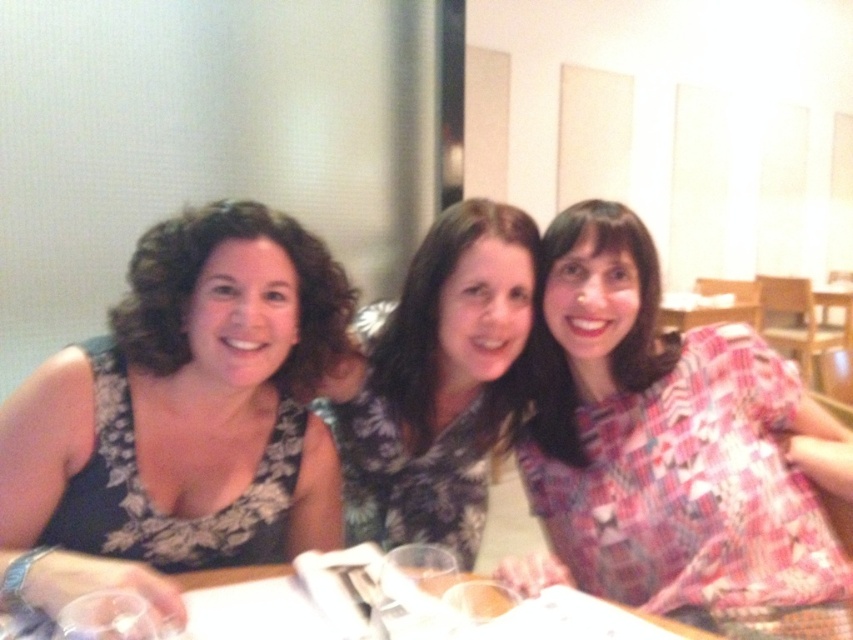
Who is higher up, floral fabric dress at center or wooden table at center?

floral fabric dress at center

Which is behind, point (398, 529) or point (283, 598)?

Point (398, 529)

Is point (503, 257) positioned behind point (210, 579)?

Yes.

Where is `floral fabric dress at center`? floral fabric dress at center is located at coordinates (434, 381).

Does floral fabric dress at left have a greater height compared to wooden table at center?

Indeed, floral fabric dress at left has a greater height compared to wooden table at center.

Between point (322, 509) and point (276, 609), which one is positioned in front?

Point (276, 609) is more forward.

Does point (234, 227) come in front of point (312, 621)?

No, it is behind (312, 621).

This screenshot has width=853, height=640. Identify the location of floral fabric dress at left. (189, 404).

Which is in front, point (331, 392) or point (438, 548)?

Point (438, 548)

Is floral fabric dress at center smaller than clear glass wine glass at center?

No, floral fabric dress at center is not smaller than clear glass wine glass at center.

Does point (390, 314) lie in front of point (422, 556)?

That is False.

Where is `floral fabric dress at center`? floral fabric dress at center is located at coordinates (434, 381).